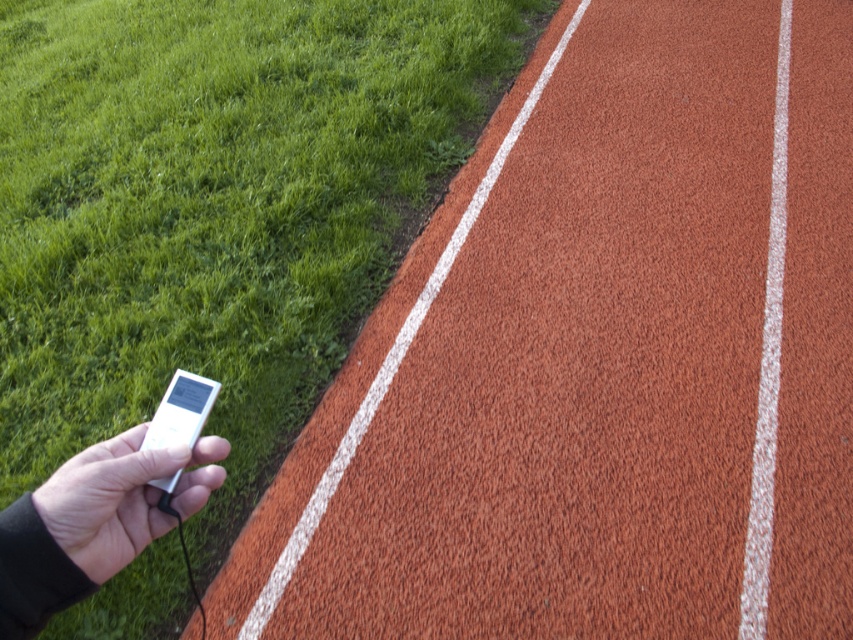
Which is in front, point (187, 516) or point (166, 392)?

Point (187, 516) is in front.

Which is behind, point (111, 547) or point (146, 444)?

The point (146, 444) is behind.

You are a GUI agent. You are given a task and a screenshot of the screen. Output one action in this format:
    pyautogui.click(x=<x>, y=<y>)
    Task: Click on the white matte ipod at lower left
    
    Given the screenshot: What is the action you would take?
    pyautogui.click(x=122, y=497)

Find the location of a particular element. white matte ipod at lower left is located at coordinates (122, 497).